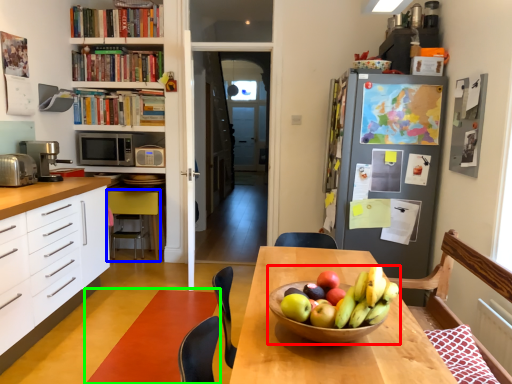
Question: Which object is the closest to the fruit dish (highlighted by a red box)? Choose among these: chair (highlighted by a blue box) or strip (highlighted by a green box).

Choices:
 (A) chair
 (B) strip

Answer: (B)